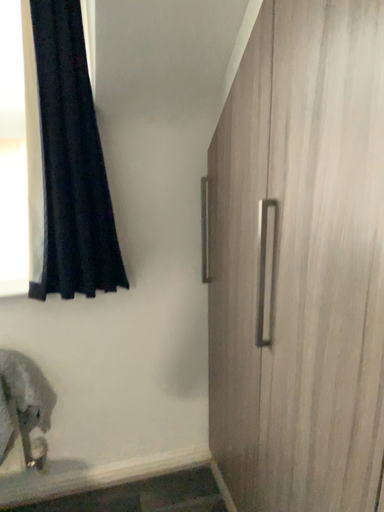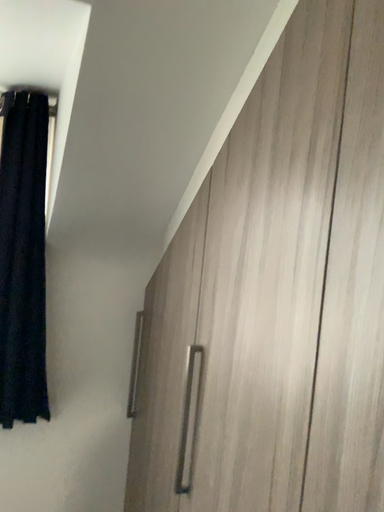
Question: How did the camera likely rotate when shooting the video?

Choices:
 (A) rotated upward
 (B) rotated downward

Answer: (A)